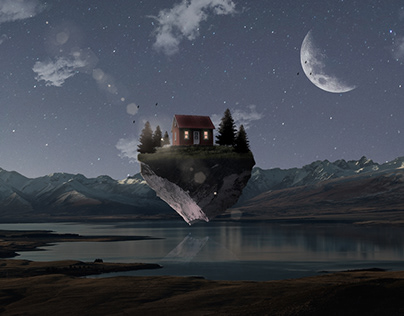
Find the location of a particular element. The image size is (404, 316). illuminated windows is located at coordinates (206, 136), (184, 137).